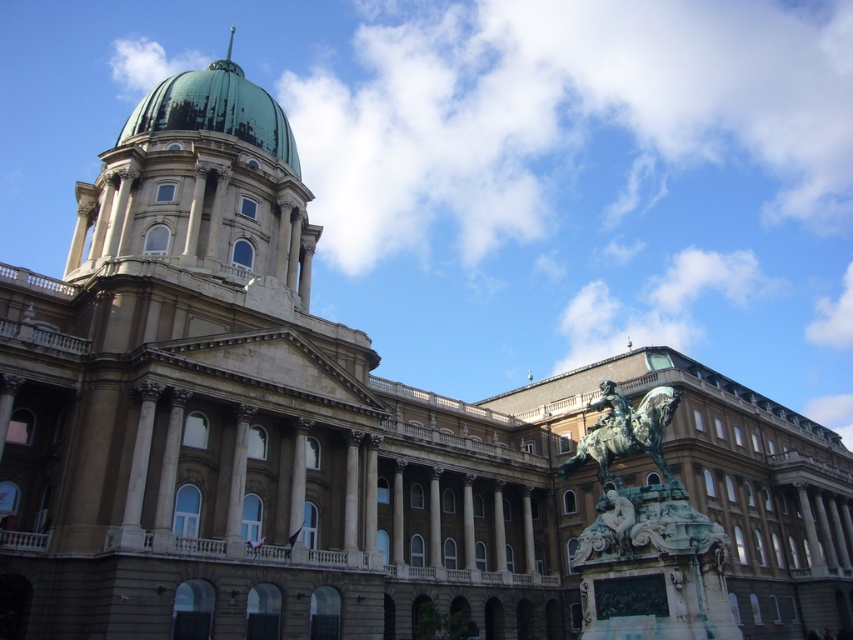
Question: Which point is farther to the camera?

Choices:
 (A) (608, 442)
 (B) (229, 54)

Answer: (B)

Question: Which point appears farthest from the camera in this image?

Choices:
 (A) (224, 113)
 (B) (231, 42)
 (C) (608, 388)

Answer: (B)

Question: Can you confirm if green polished dome at upper center is positioned to the right of green patina spire at top?

Choices:
 (A) no
 (B) yes

Answer: (B)

Question: Does green patina statue at center-right appear on the left side of green patina spire at top?

Choices:
 (A) no
 (B) yes

Answer: (A)

Question: Which point appears farthest from the camera in this image?

Choices:
 (A) (283, 134)
 (B) (230, 54)

Answer: (B)

Question: Is green polished dome at upper center wider than green patina statue at center-right?

Choices:
 (A) no
 (B) yes

Answer: (B)